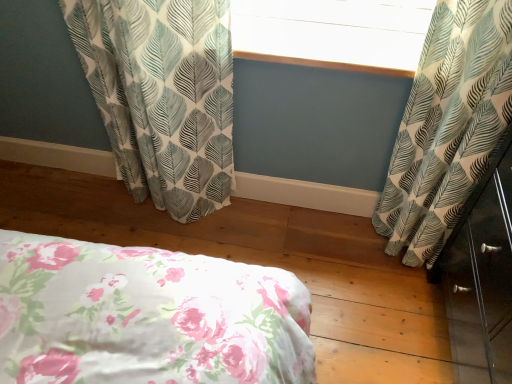
The height and width of the screenshot is (384, 512). What are the coordinates of `white leaf-patterned curtain at left, which is the second curtain in right-to-left order` in the screenshot? It's located at (162, 95).

The width and height of the screenshot is (512, 384). What do you see at coordinates (333, 33) in the screenshot?
I see `white textured window screen at upper center` at bounding box center [333, 33].

Image resolution: width=512 pixels, height=384 pixels. Identify the location of white leaf-patterned curtain at right, which ranks as the first curtain in right-to-left order. point(447,125).

Image resolution: width=512 pixels, height=384 pixels. Find the location of `white leaf-patterned curtain at left, marked as the first curtain in a left-to-right arrangement`. white leaf-patterned curtain at left, marked as the first curtain in a left-to-right arrangement is located at coordinates (162, 95).

Looking at this image, based on their sizes in the image, would you say white leaf-patterned curtain at right, the 2th curtain from the left, is bigger or smaller than white textured window screen at upper center?

Clearly, white leaf-patterned curtain at right, the 2th curtain from the left, is larger in size than white textured window screen at upper center.

Which is correct: white leaf-patterned curtain at right, which ranks as the first curtain in right-to-left order, is inside white textured window screen at upper center, or outside of it?

white leaf-patterned curtain at right, which ranks as the first curtain in right-to-left order, is located beyond the bounds of white textured window screen at upper center.

Is point (428, 107) closer or farther from the camera than point (353, 33)?

Clearly, point (428, 107) is closer to the camera than point (353, 33).

From the picture: Considering the relative sizes of white leaf-patterned curtain at left, which is the second curtain in right-to-left order, and white leaf-patterned curtain at right, which ranks as the first curtain in right-to-left order, in the image provided, is white leaf-patterned curtain at left, which is the second curtain in right-to-left order, shorter than white leaf-patterned curtain at right, which ranks as the first curtain in right-to-left order,?

Yes, white leaf-patterned curtain at left, which is the second curtain in right-to-left order, is shorter than white leaf-patterned curtain at right, which ranks as the first curtain in right-to-left order.

Which is more to the right, white leaf-patterned curtain at left, which is the second curtain in right-to-left order, or white leaf-patterned curtain at right, which ranks as the first curtain in right-to-left order?

white leaf-patterned curtain at right, which ranks as the first curtain in right-to-left order.

Is point (202, 100) farther from camera compared to point (441, 156)?

Yes, point (202, 100) is farther from viewer.

Could you tell me if white leaf-patterned curtain at left, which is the second curtain in right-to-left order, is facing white textured window screen at upper center?

No, white leaf-patterned curtain at left, which is the second curtain in right-to-left order, is not aimed at white textured window screen at upper center.

Considering the positions of objects white leaf-patterned curtain at left, which is the second curtain in right-to-left order, and white textured window screen at upper center in the image provided, who is more to the right, white leaf-patterned curtain at left, which is the second curtain in right-to-left order, or white textured window screen at upper center?

white textured window screen at upper center is more to the right.

Is the surface of white leaf-patterned curtain at left, which is the second curtain in right-to-left order, in direct contact with white textured window screen at upper center?

There is a gap between white leaf-patterned curtain at left, which is the second curtain in right-to-left order, and white textured window screen at upper center.

Where is `the 2nd curtain located beneath the white textured window screen at upper center (from a real-world perspective)`? the 2nd curtain located beneath the white textured window screen at upper center (from a real-world perspective) is located at coordinates (162, 95).

Visually, is white textured window screen at upper center positioned to the left or to the right of white leaf-patterned curtain at left, marked as the first curtain in a left-to-right arrangement?

Based on their positions, white textured window screen at upper center is located to the right of white leaf-patterned curtain at left, marked as the first curtain in a left-to-right arrangement.

Is white textured window screen at upper center situated inside white leaf-patterned curtain at left, which is the second curtain in right-to-left order, or outside?

white textured window screen at upper center is outside white leaf-patterned curtain at left, which is the second curtain in right-to-left order.

Between white textured window screen at upper center and white leaf-patterned curtain at left, marked as the first curtain in a left-to-right arrangement, which one has larger width?

white textured window screen at upper center.

Is point (318, 23) behind point (215, 69)?

Yes, point (318, 23) is farther from viewer.

Is the surface of white leaf-patterned curtain at right, the 2th curtain from the left, in direct contact with white leaf-patterned curtain at left, which is the second curtain in right-to-left order?

They are not placed beside each other.

Considering the positions of objects white leaf-patterned curtain at right, which ranks as the first curtain in right-to-left order, and white leaf-patterned curtain at left, which is the second curtain in right-to-left order, in the image provided, who is more to the left, white leaf-patterned curtain at right, which ranks as the first curtain in right-to-left order, or white leaf-patterned curtain at left, which is the second curtain in right-to-left order,?

Positioned to the left is white leaf-patterned curtain at left, which is the second curtain in right-to-left order.

Image resolution: width=512 pixels, height=384 pixels. What are the coordinates of `curtain below the white leaf-patterned curtain at right, which ranks as the first curtain in right-to-left order (from a real-world perspective)` in the screenshot? It's located at (162, 95).

Who is smaller, white leaf-patterned curtain at right, which ranks as the first curtain in right-to-left order, or white leaf-patterned curtain at left, marked as the first curtain in a left-to-right arrangement?

white leaf-patterned curtain at right, which ranks as the first curtain in right-to-left order.

Could you tell me if white textured window screen at upper center is facing white leaf-patterned curtain at right, the 2th curtain from the left?

No, white textured window screen at upper center is not aimed at white leaf-patterned curtain at right, the 2th curtain from the left.

How different are the orientations of white textured window screen at upper center and white leaf-patterned curtain at right, which ranks as the first curtain in right-to-left order, in degrees?

They differ by 3.75 degrees in their facing directions.

Could you measure the distance between white textured window screen at upper center and white leaf-patterned curtain at right, the 2th curtain from the left?

white textured window screen at upper center is 13.09 inches from white leaf-patterned curtain at right, the 2th curtain from the left.

Which is in front, point (265, 49) or point (490, 12)?

The point (490, 12) is in front.

The image size is (512, 384). In order to click on the 2nd curtain below when counting from the white textured window screen at upper center (from the image's perspective) in this screenshot , I will do `click(447, 125)`.

You are a GUI agent. You are given a task and a screenshot of the screen. Output one action in this format:
    pyautogui.click(x=<x>, y=<y>)
    Task: Click on the curtain lying above the white leaf-patterned curtain at right, the 2th curtain from the left (from the image's perspective)
    
    Given the screenshot: What is the action you would take?
    pyautogui.click(x=162, y=95)

From the picture: When comparing their distances from white textured window screen at upper center, does white leaf-patterned curtain at right, the 2th curtain from the left, or white leaf-patterned curtain at left, marked as the first curtain in a left-to-right arrangement, seem further?

white leaf-patterned curtain at left, marked as the first curtain in a left-to-right arrangement, is positioned further to the anchor white textured window screen at upper center.

Which object lies nearer to the anchor point white textured window screen at upper center, white leaf-patterned curtain at left, which is the second curtain in right-to-left order, or white leaf-patterned curtain at right, which ranks as the first curtain in right-to-left order?

white leaf-patterned curtain at right, which ranks as the first curtain in right-to-left order.

Based on their spatial positions, is white textured window screen at upper center or white leaf-patterned curtain at left, marked as the first curtain in a left-to-right arrangement, closer to white leaf-patterned curtain at right, which ranks as the first curtain in right-to-left order?

white textured window screen at upper center is positioned closer to the anchor white leaf-patterned curtain at right, which ranks as the first curtain in right-to-left order.

Based on their spatial positions, is white leaf-patterned curtain at left, marked as the first curtain in a left-to-right arrangement, or white textured window screen at upper center further from white leaf-patterned curtain at right, the 2th curtain from the left?

white leaf-patterned curtain at left, marked as the first curtain in a left-to-right arrangement.

When comparing their distances from white leaf-patterned curtain at left, marked as the first curtain in a left-to-right arrangement, does white leaf-patterned curtain at right, which ranks as the first curtain in right-to-left order, or white textured window screen at upper center seem closer?

white textured window screen at upper center is closer to white leaf-patterned curtain at left, marked as the first curtain in a left-to-right arrangement.

Which object lies further to the anchor point white leaf-patterned curtain at left, which is the second curtain in right-to-left order, white textured window screen at upper center or white leaf-patterned curtain at right, which ranks as the first curtain in right-to-left order?

Among the two, white leaf-patterned curtain at right, which ranks as the first curtain in right-to-left order, is located further to white leaf-patterned curtain at left, which is the second curtain in right-to-left order.

Where is `window screen located between white leaf-patterned curtain at left, marked as the first curtain in a left-to-right arrangement, and white leaf-patterned curtain at right, which ranks as the first curtain in right-to-left order, in the left-right direction`? The width and height of the screenshot is (512, 384). window screen located between white leaf-patterned curtain at left, marked as the first curtain in a left-to-right arrangement, and white leaf-patterned curtain at right, which ranks as the first curtain in right-to-left order, in the left-right direction is located at coordinates (333, 33).